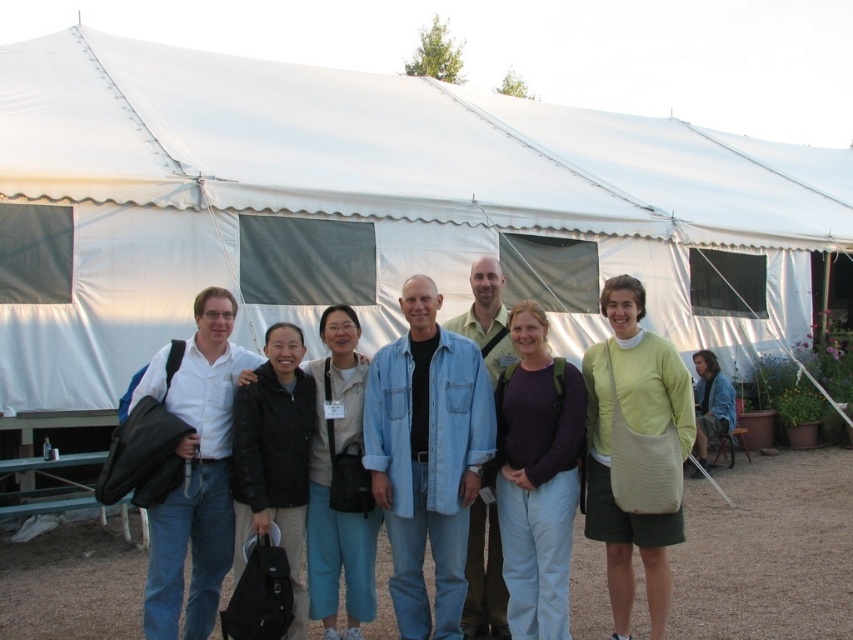
Question: Among these objects, which one is farthest from the camera?

Choices:
 (A) purple cotton shirt at center
 (B) white fabric canopy at center
 (C) denim jacket at lower right
 (D) denim jacket at center

Answer: (C)

Question: Which object appears closest to the camera in this image?

Choices:
 (A) denim jacket at center
 (B) denim shirt at center
 (C) matte white shirt at center

Answer: (C)

Question: Does black matte jacket at center lie behind light blue denim jacket at center?

Choices:
 (A) yes
 (B) no

Answer: (B)

Question: Which of the following is the farthest from the observer?

Choices:
 (A) tap(329, 314)
 (B) tap(231, 304)
 (C) tap(241, 61)
 (D) tap(672, 512)

Answer: (C)

Question: Is purple cotton shirt at center in front of light blue denim jacket at center?

Choices:
 (A) yes
 (B) no

Answer: (A)

Question: Can you confirm if white fabric canopy at center is positioned below light blue denim jacket at center?

Choices:
 (A) yes
 (B) no

Answer: (B)